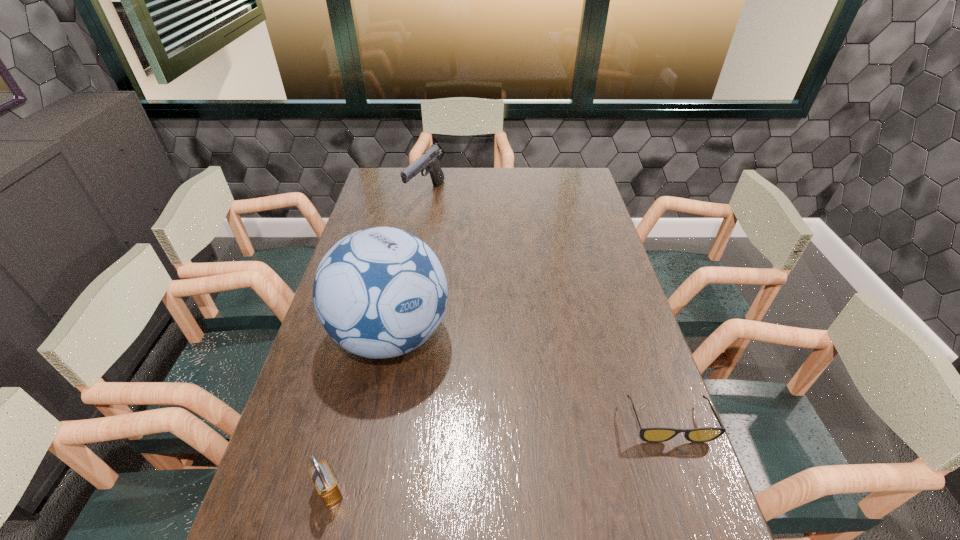
Where is `padlock`? padlock is located at coordinates (323, 479).

At what (x,y) coordinates should I click in order to perform the action: click on the nearest object. Please return your answer as a coordinate pair (x, y). The height and width of the screenshot is (540, 960). Looking at the image, I should click on (323, 479).

Identify the location of the shortest object. The width and height of the screenshot is (960, 540). (650, 434).

I want to click on sunglasses, so click(650, 434).

You are a GUI agent. You are given a task and a screenshot of the screen. Output one action in this format:
    pyautogui.click(x=<x>, y=<y>)
    Task: Click on the farthest object
    
    Given the screenshot: What is the action you would take?
    pyautogui.click(x=430, y=160)

Where is `the third shortest object`? the third shortest object is located at coordinates (430, 160).

The height and width of the screenshot is (540, 960). I want to click on soccer ball, so click(x=381, y=292).

Locate an element on the screen. the tallest object is located at coordinates (381, 292).

Find the location of a particular element. free location located 0.060m on the right of the third tallest object is located at coordinates (372, 491).

Image resolution: width=960 pixels, height=540 pixels. In order to click on free space located on the front-facing side of the rightmost object in this screenshot , I will do point(703,517).